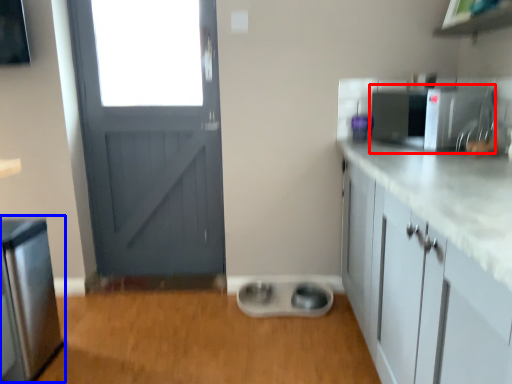
Question: Which of the following is the closest to the observer, appliance (highlighted by a red box) or appliance (highlighted by a blue box)?

Choices:
 (A) appliance
 (B) appliance

Answer: (B)